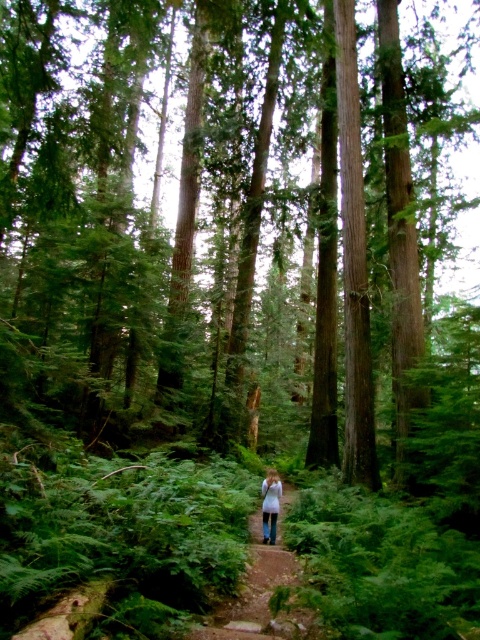
Does white fabric at center have a greater height compared to white cotton shirt at center?

No, white fabric at center is not taller than white cotton shirt at center.

Does point (240, 608) lie behind point (273, 493)?

No.

Who is more forward, [291,552] or [267,540]?

Point [291,552] is in front.

The width and height of the screenshot is (480, 640). Find the location of `white fabric at center`. white fabric at center is located at coordinates (261, 589).